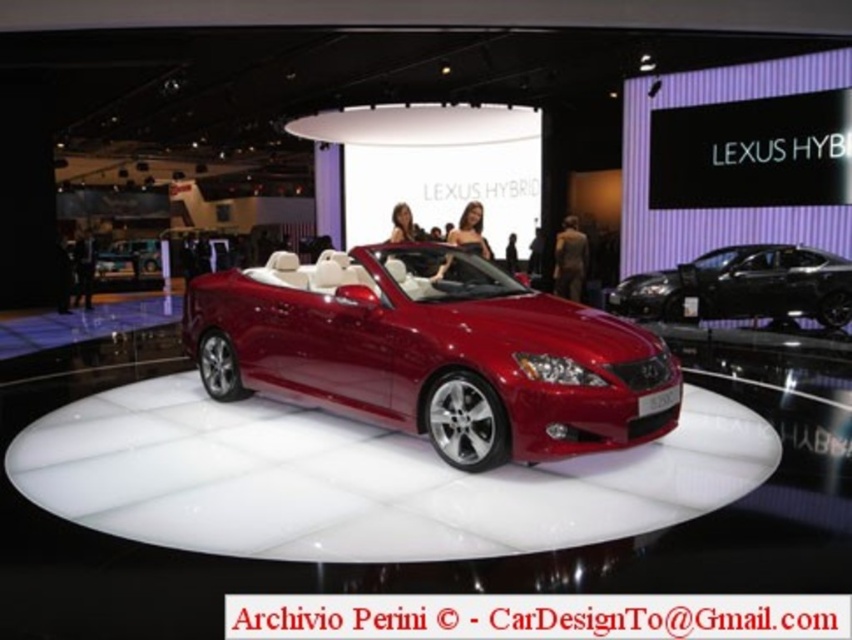
Question: Which point is farther to the camera?

Choices:
 (A) (366, 360)
 (B) (159, 250)

Answer: (B)

Question: Does shiny red convertible at center appear over glossy black sedan at center?

Choices:
 (A) no
 (B) yes

Answer: (A)

Question: Is glossy black sedan at center thinner than metallic silver car at center?

Choices:
 (A) no
 (B) yes

Answer: (A)

Question: Based on their relative distances, which object is nearer to the metallic silver car at center?

Choices:
 (A) shiny red convertible at center
 (B) glossy black sedan at center

Answer: (A)

Question: Which of these objects is positioned farthest from the metallic silver car at center?

Choices:
 (A) shiny red convertible at center
 (B) glossy black sedan at center

Answer: (B)

Question: Does shiny red convertible at center appear under glossy black sedan at center?

Choices:
 (A) no
 (B) yes

Answer: (B)